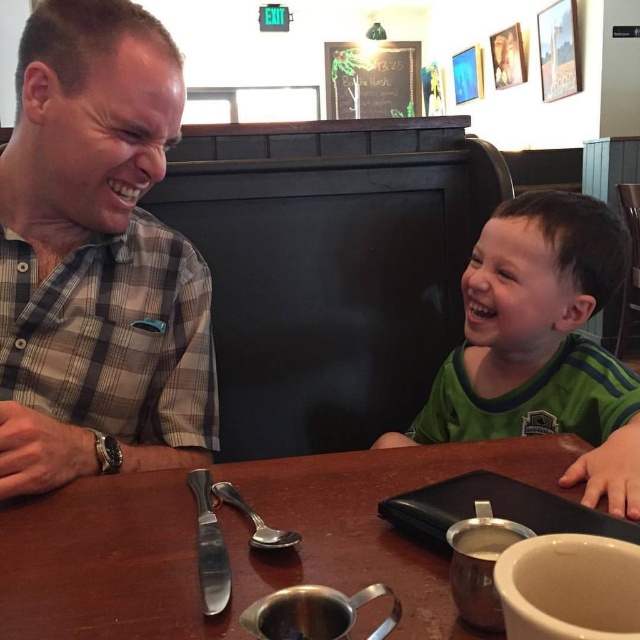
Which is above, plaid shirt at left or metallic silver creamer at center?

plaid shirt at left is higher up.

Is plaid shirt at left above metallic silver creamer at center?

Indeed, plaid shirt at left is positioned over metallic silver creamer at center.

Who is more distant from viewer, (29,474) or (451,545)?

The point (29,474) is behind.

At what (x,y) coordinates should I click in order to perform the action: click on plaid shirt at left. Please return your answer as a coordinate pair (x, y). This screenshot has height=640, width=640. Looking at the image, I should click on (97, 259).

Does plaid shirt at left appear under green jersey at right?

Actually, plaid shirt at left is above green jersey at right.

Is plaid shirt at left thinner than green jersey at right?

Yes.

The image size is (640, 640). What are the coordinates of `plaid shirt at left` in the screenshot? It's located at (97, 259).

Is green jersey at right in front of metallic silver creamer at center?

No, green jersey at right is further to the viewer.

From the picture: Which of these two, green jersey at right or metallic silver creamer at center, stands shorter?

metallic silver creamer at center

Identify the location of green jersey at right. Image resolution: width=640 pixels, height=640 pixels. (541, 344).